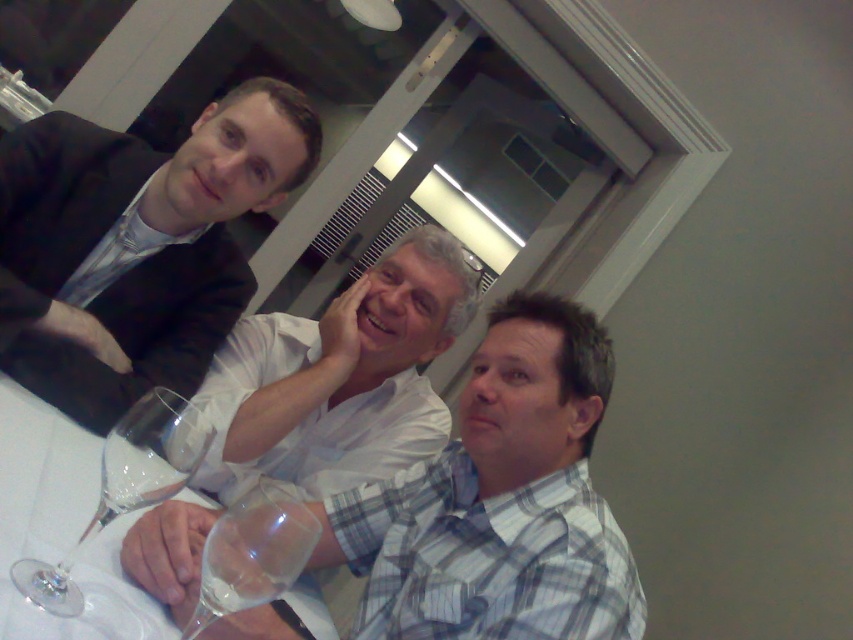
Question: Is transparent glass wine glass at lower center smaller than clear glass wine at lower left?

Choices:
 (A) yes
 (B) no

Answer: (B)

Question: Is matte black suit at upper left closer to camera compared to transparent glass wine glass at lower left?

Choices:
 (A) no
 (B) yes

Answer: (A)

Question: Which point is farther to the camera?

Choices:
 (A) clear glass wine at lower left
 (B) transparent glass wine glass at lower left

Answer: (A)

Question: Does matte black suit at upper left appear on the right side of clear glass wine at lower left?

Choices:
 (A) yes
 (B) no

Answer: (B)

Question: Among these points, which one is farthest from the camera?

Choices:
 (A) (114, 490)
 (B) (212, 579)

Answer: (B)

Question: Which point is farther to the camera?

Choices:
 (A) (155, 481)
 (B) (151, 436)

Answer: (A)